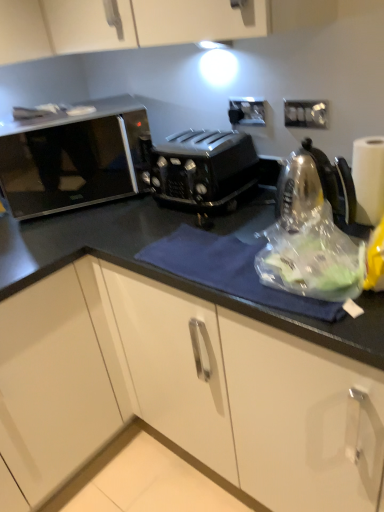
Question: From a real-world perspective, is white paper at right positioned over white plastic electric outlet at upper right, the second electric outlet viewed from the left, based on gravity?

Choices:
 (A) no
 (B) yes

Answer: (A)

Question: Is white paper at right far from white plastic electric outlet at upper right, marked as the first electric outlet in a right-to-left arrangement?

Choices:
 (A) no
 (B) yes

Answer: (A)

Question: Is white paper at right to the right of white plastic electric outlet at upper right, the 2th electric outlet when ordered from back to front, from the viewer's perspective?

Choices:
 (A) no
 (B) yes

Answer: (B)

Question: Is white plastic electric outlet at upper right, the 2th electric outlet when ordered from back to front, located within white paper at right?

Choices:
 (A) yes
 (B) no

Answer: (B)

Question: From the image's perspective, would you say white paper at right is shown under white plastic electric outlet at upper right, which is the first electric outlet in front-to-back order?

Choices:
 (A) no
 (B) yes

Answer: (B)

Question: Does point (251, 172) appear closer or farther from the camera than point (382, 141)?

Choices:
 (A) farther
 (B) closer

Answer: (A)

Question: From a real-world perspective, is black plastic toaster at center above or below white paper at right?

Choices:
 (A) above
 (B) below

Answer: (B)

Question: Based on their sizes in the image, would you say black plastic toaster at center is bigger or smaller than white paper at right?

Choices:
 (A) big
 (B) small

Answer: (A)

Question: Looking at their shapes, would you say black plastic toaster at center is wider or thinner than white paper at right?

Choices:
 (A) wide
 (B) thin

Answer: (A)

Question: Considering the positions of point (51, 164) and point (180, 170), is point (51, 164) closer or farther from the camera than point (180, 170)?

Choices:
 (A) farther
 (B) closer

Answer: (A)

Question: From a real-world perspective, relative to black plastic toaster at center, is sleek black microwave at left vertically above or below?

Choices:
 (A) above
 (B) below

Answer: (A)

Question: Considering the positions of sleek black microwave at left and black plastic toaster at center in the image, is sleek black microwave at left bigger or smaller than black plastic toaster at center?

Choices:
 (A) small
 (B) big

Answer: (B)

Question: Would you say sleek black microwave at left is to the left or to the right of black plastic toaster at center in the picture?

Choices:
 (A) left
 (B) right

Answer: (A)

Question: From a real-world perspective, relative to sleek black microwave at left, is white paper at right vertically above or below?

Choices:
 (A) below
 (B) above

Answer: (A)

Question: In terms of height, does white paper at right look taller or shorter compared to sleek black microwave at left?

Choices:
 (A) short
 (B) tall

Answer: (A)